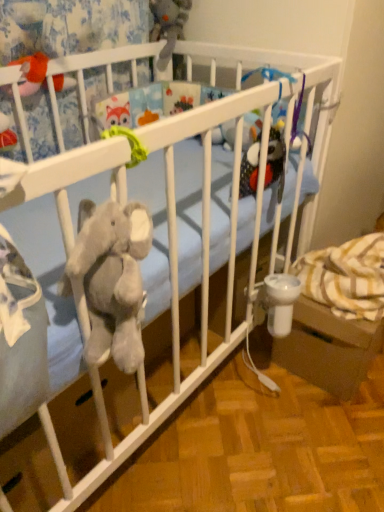
Question: From the image's perspective, is white plastic baby carriage at lower right under gray plush toy at upper center, which ranks as the 2th toy in bottom-to-top order?

Choices:
 (A) no
 (B) yes

Answer: (B)

Question: Is white plastic baby carriage at lower right turned away from gray plush toy at upper center, which appears as the 1th toy when viewed from the right?

Choices:
 (A) yes
 (B) no

Answer: (B)

Question: Is white plastic baby carriage at lower right wider than gray plush toy at upper center, the 2th toy in the front-to-back sequence?

Choices:
 (A) yes
 (B) no

Answer: (A)

Question: Can you confirm if white plastic baby carriage at lower right is bigger than gray plush toy at upper center, which is counted as the first toy, starting from the top?

Choices:
 (A) no
 (B) yes

Answer: (B)

Question: Is white plastic baby carriage at lower right to the left of gray plush toy at upper center, which is the second toy from left to right, from the viewer's perspective?

Choices:
 (A) yes
 (B) no

Answer: (B)

Question: Considering the positions of fuzzy orange toy at upper left, which is the second toy from top to bottom, and gray plush toy at upper center, which is counted as the first toy, starting from the top, in the image, is fuzzy orange toy at upper left, which is the second toy from top to bottom, bigger or smaller than gray plush toy at upper center, which is counted as the first toy, starting from the top,?

Choices:
 (A) big
 (B) small

Answer: (B)

Question: Is fuzzy orange toy at upper left, which ranks as the 2th toy in right-to-left order, to the left or to the right of gray plush toy at upper center, which is the second toy from left to right, in the image?

Choices:
 (A) left
 (B) right

Answer: (A)

Question: Considering the positions of fuzzy orange toy at upper left, which ranks as the 2th toy in right-to-left order, and gray plush toy at upper center, which appears as the 1th toy when viewed from the right, in the image, is fuzzy orange toy at upper left, which ranks as the 2th toy in right-to-left order, taller or shorter than gray plush toy at upper center, which appears as the 1th toy when viewed from the right,?

Choices:
 (A) tall
 (B) short

Answer: (B)

Question: Is fuzzy orange toy at upper left, which ranks as the 1th toy in front-to-back order, in front of or behind gray plush toy at upper center, which is counted as the first toy, starting from the top, in the image?

Choices:
 (A) front
 (B) behind

Answer: (A)

Question: Is white plastic baby carriage at lower right bigger or smaller than gray plush toy at upper center, the first toy when ordered from back to front?

Choices:
 (A) small
 (B) big

Answer: (B)

Question: In terms of height, does white plastic baby carriage at lower right look taller or shorter compared to gray plush toy at upper center, the 2th toy in the front-to-back sequence?

Choices:
 (A) tall
 (B) short

Answer: (A)

Question: Is point (380, 333) closer or farther from the camera than point (178, 10)?

Choices:
 (A) farther
 (B) closer

Answer: (B)

Question: Looking at their shapes, would you say white plastic baby carriage at lower right is wider or thinner than gray plush toy at upper center, which is the second toy from left to right?

Choices:
 (A) thin
 (B) wide

Answer: (B)

Question: In the image, is white plastic baby carriage at lower right positioned in front of or behind fuzzy orange toy at upper left, which ranks as the 1th toy in front-to-back order?

Choices:
 (A) front
 (B) behind

Answer: (B)

Question: Looking at their shapes, would you say white plastic baby carriage at lower right is wider or thinner than fuzzy orange toy at upper left, which is the second toy from top to bottom?

Choices:
 (A) wide
 (B) thin

Answer: (A)